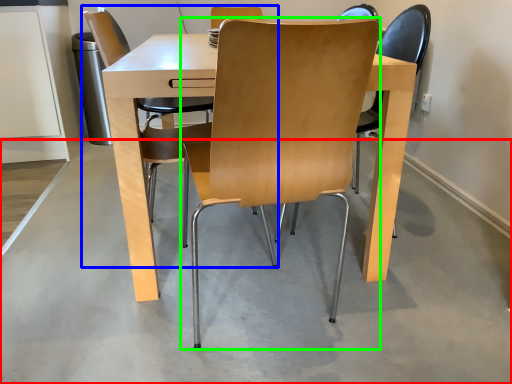
Question: Which object is positioned farthest from concrete (highlighted by a red box)? Select from chair (highlighted by a blue box) and chair (highlighted by a green box).

Choices:
 (A) chair
 (B) chair

Answer: (A)